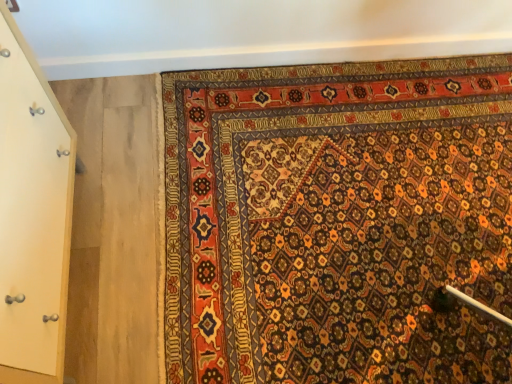
Describe the element at coordinates (338, 222) in the screenshot. I see `carpet with intricate patterns at lower right` at that location.

Where is `carpet with intricate patterns at lower right`? This screenshot has width=512, height=384. carpet with intricate patterns at lower right is located at coordinates (338, 222).

The width and height of the screenshot is (512, 384). What do you see at coordinates (32, 215) in the screenshot? I see `light wood door at left` at bounding box center [32, 215].

You are a GUI agent. You are given a task and a screenshot of the screen. Output one action in this format:
    pyautogui.click(x=<x>, y=<y>)
    Task: Click on the light wood door at left
    
    Given the screenshot: What is the action you would take?
    pyautogui.click(x=32, y=215)

At what (x,y) coordinates should I click in order to perform the action: click on carpet with intricate patterns at lower right. Please return your answer as a coordinate pair (x, y). The height and width of the screenshot is (384, 512). Looking at the image, I should click on (338, 222).

Considering the positions of objects light wood door at left and carpet with intricate patterns at lower right in the image provided, who is more to the right, light wood door at left or carpet with intricate patterns at lower right?

carpet with intricate patterns at lower right is more to the right.

Between light wood door at left and carpet with intricate patterns at lower right, which one is positioned in front?

light wood door at left.

Which is behind, point (2, 204) or point (420, 238)?

Positioned behind is point (420, 238).

From the image's perspective, which object appears higher, light wood door at left or carpet with intricate patterns at lower right?

From the image's view, carpet with intricate patterns at lower right is above.

Looking at this image, from a real-world perspective, is light wood door at left located beneath carpet with intricate patterns at lower right?

No, from a real-world perspective, light wood door at left is not below carpet with intricate patterns at lower right.

Which object is wider, light wood door at left or carpet with intricate patterns at lower right?

carpet with intricate patterns at lower right.

Considering the sizes of objects light wood door at left and carpet with intricate patterns at lower right in the image provided, who is taller, light wood door at left or carpet with intricate patterns at lower right?

light wood door at left is taller.

Is light wood door at left bigger than carpet with intricate patterns at lower right?

Yes.

Is light wood door at left situated inside carpet with intricate patterns at lower right or outside?

light wood door at left lies outside carpet with intricate patterns at lower right.

Is light wood door at left far away from carpet with intricate patterns at lower right?

No, there isn't a large distance between light wood door at left and carpet with intricate patterns at lower right.

Is light wood door at left turned away from carpet with intricate patterns at lower right?

No, light wood door at left is not facing the opposite direction of carpet with intricate patterns at lower right.

How distant is light wood door at left from carpet with intricate patterns at lower right?

light wood door at left is 24.14 inches from carpet with intricate patterns at lower right.

Identify the location of mat on the right of the light wood door at left. This screenshot has width=512, height=384. (338, 222).

Which object is positioned more to the left, carpet with intricate patterns at lower right or light wood door at left?

From the viewer's perspective, light wood door at left appears more on the left side.

Is the position of carpet with intricate patterns at lower right more distant than that of light wood door at left?

That is True.

Considering the points (407, 164) and (40, 102), which point is behind, point (407, 164) or point (40, 102)?

The point (407, 164) is behind.

From the image's perspective, is carpet with intricate patterns at lower right positioned above or below light wood door at left?

Clearly, from the image's perspective, carpet with intricate patterns at lower right is above light wood door at left.

In the scene shown: From a real-world perspective, which is physically above, carpet with intricate patterns at lower right or light wood door at left?

light wood door at left, from a real-world perspective.

Considering the sizes of objects carpet with intricate patterns at lower right and light wood door at left in the image provided, who is wider, carpet with intricate patterns at lower right or light wood door at left?

Wider between the two is carpet with intricate patterns at lower right.

Between carpet with intricate patterns at lower right and light wood door at left, which one has less height?

carpet with intricate patterns at lower right.

Considering the sizes of carpet with intricate patterns at lower right and light wood door at left in the image, is carpet with intricate patterns at lower right bigger or smaller than light wood door at left?

Clearly, carpet with intricate patterns at lower right is smaller in size than light wood door at left.

Would you say carpet with intricate patterns at lower right is outside light wood door at left?

Yes.

Is carpet with intricate patterns at lower right with light wood door at left?

No, carpet with intricate patterns at lower right is not touching light wood door at left.

Is carpet with intricate patterns at lower right oriented towards light wood door at left?

No, carpet with intricate patterns at lower right is not facing towards light wood door at left.

Can you tell me how much carpet with intricate patterns at lower right and light wood door at left differ in facing direction?

The facing directions of carpet with intricate patterns at lower right and light wood door at left are 89.2 degrees apart.

At what (x,y) coordinates should I click in order to perform the action: click on mat behind the light wood door at left. Please return your answer as a coordinate pair (x, y). This screenshot has width=512, height=384. Looking at the image, I should click on (338, 222).

Identify the location of mat below the light wood door at left (from a real-world perspective). (338, 222).

What are the coordinates of `mat on the right of the light wood door at left` in the screenshot? It's located at (338, 222).